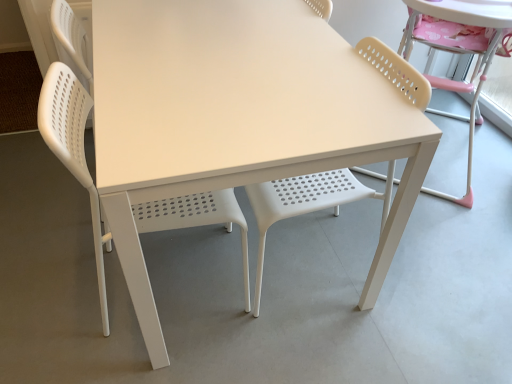
This screenshot has height=384, width=512. Find the location of `free location in front of beige perforated chair at right, placed as the 3th chair when sorted from left to right`. free location in front of beige perforated chair at right, placed as the 3th chair when sorted from left to right is located at coordinates click(x=449, y=237).